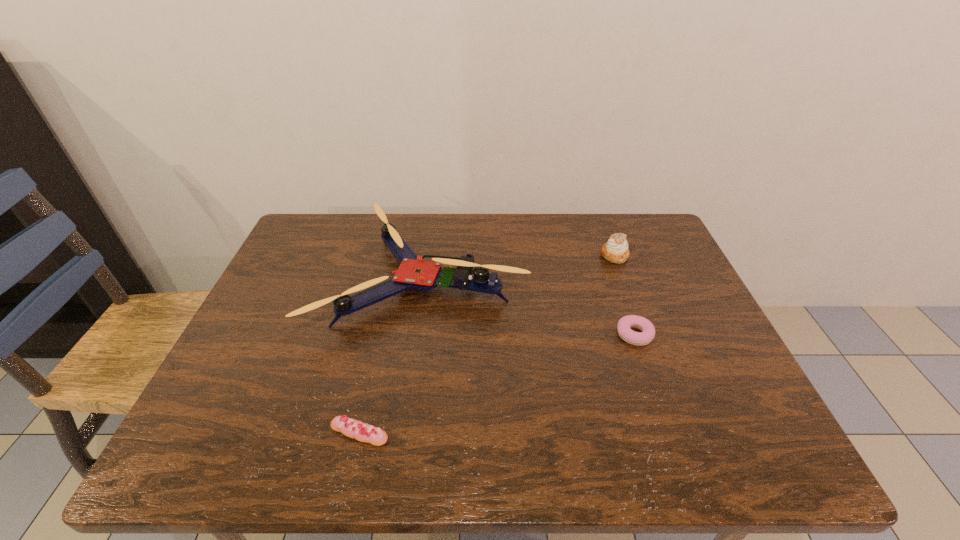
Identify the location of free area in between the second tallest object and the nearest object. The width and height of the screenshot is (960, 540). pyautogui.click(x=487, y=344).

Point out which object is positioned as the nearest to the nearer pastry. Please provide its 2D coordinates. Your answer should be formatted as a tuple, i.e. [(x, y)], where the tuple contains the x and y coordinates of a point satisfying the conditions above.

[(413, 273)]

Locate which object ranks in proximity to the eclair. Please provide its 2D coordinates. Your answer should be formatted as a tuple, i.e. [(x, y)], where the tuple contains the x and y coordinates of a point satisfying the conditions above.

[(413, 273)]

Where is `free spot that satisfies the following two spatial constraints: 1. on the back side of the third shortest object; 2. on the right side of the drone`? free spot that satisfies the following two spatial constraints: 1. on the back side of the third shortest object; 2. on the right side of the drone is located at coordinates point(427,255).